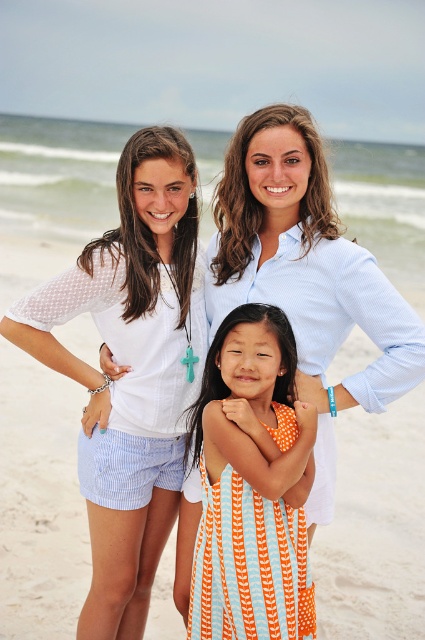
Based on the scene description, where exactly is the white seersucker shorts at left located in the image?

The white seersucker shorts at left is located at point (133, 371).

You are a photographer trying to capture a group photo of the three people. You want to ensure that the white seersucker shorts at left and the light blue striped shirt at center are both clearly visible in the frame. Based on their positions, which clothing item is lower in the image?

The white seersucker shorts at left is located below the light blue striped shirt at center, so the white seersucker shorts at left is lower in the image.

You are a photographer planning to take a group photo of the light blue striped shirt at center and the orange striped dress at center. Since you want to ensure both are clearly visible, which clothing item should you focus on first to make sure it fits within the frame?

The light blue striped shirt at center is bigger than the orange striped dress at center, so you should focus on ensuring the light blue striped shirt at center fits within the frame first to accommodate its larger size.